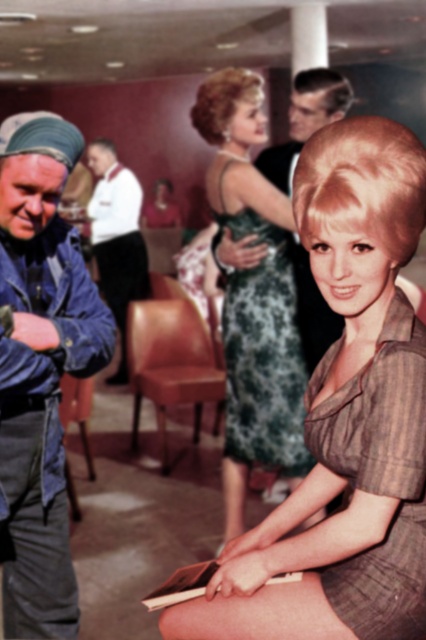
You are organizing a fashion show and need to arrange the shiny brown dress at center and the green lace dress at center side by side on a runway. Which dress should be placed on the left side to ensure they fit within the 2.5 meter runway width?

The shiny brown dress at center has a lesser width compared to the green lace dress at center. To fit both dresses within the 2.5 meter runway width, place the narrower shiny brown dress at center on the left side so that there is enough space for the wider green lace dress at center on the right side without exceeding the total width limit.

You are a photographer setting up a shoot and need to arrange two props. The blue denim jacket at left and the green lace dress at center are both part of the setup. If you want to place them side by side on a table, which one should you choose to be on the left side to ensure they fit within the table length?

The blue denim jacket at left is narrower than the green lace dress at center, so placing the blue denim jacket at left on the left side would allow both items to fit better on the table since it takes up less space.

In the scene described, there is a blue denim jacket at left and a green lace dress at center. Which one has a greater height?

The green lace dress at center is taller than the blue denim jacket at left according to the description.